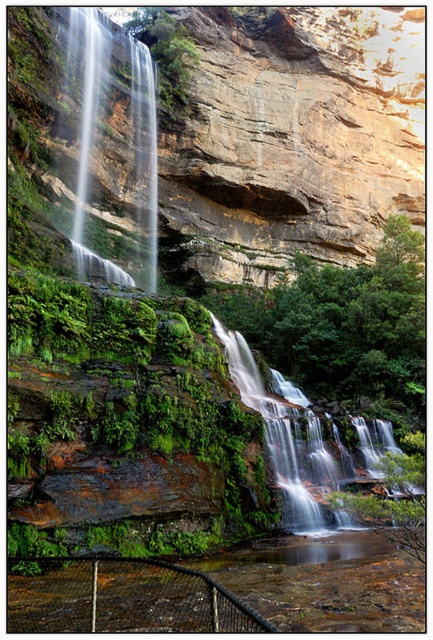
Based on the photo, who is positioned more to the left, rustic stone cliff at upper center or clear water at center?

From the viewer's perspective, clear water at center appears more on the left side.

Describe the element at coordinates (226, 134) in the screenshot. I see `rustic stone cliff at upper center` at that location.

Where is `rustic stone cliff at upper center`? The height and width of the screenshot is (640, 433). rustic stone cliff at upper center is located at coordinates (226, 134).

In the scene shown: Does white frothy water at center have a smaller size compared to clear water at center?

Yes, white frothy water at center is smaller than clear water at center.

Is point (297, 445) farther from viewer compared to point (149, 161)?

No.

Which is in front, point (272, 429) or point (87, 22)?

Point (272, 429) is in front.

Locate an element on the screen. The image size is (433, 640). white frothy water at center is located at coordinates (286, 435).

Between rustic stone cliff at upper center and white frothy water at center, which one appears on the right side from the viewer's perspective?

From the viewer's perspective, rustic stone cliff at upper center appears more on the right side.

Can you confirm if rustic stone cliff at upper center is positioned above white frothy water at center?

Indeed, rustic stone cliff at upper center is positioned over white frothy water at center.

Does point (22, 152) come behind point (258, 400)?

Yes, it is behind point (258, 400).

Where is `rustic stone cliff at upper center`? Image resolution: width=433 pixels, height=640 pixels. rustic stone cliff at upper center is located at coordinates (226, 134).